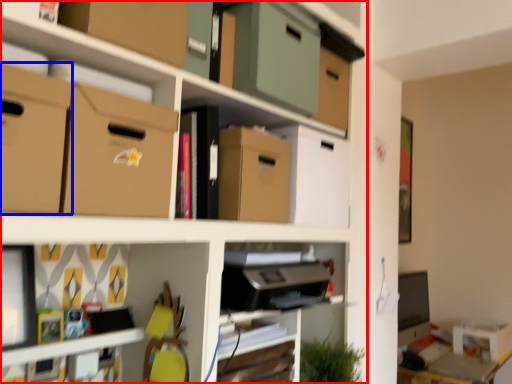
Question: Which object is further to the camera taking this photo, shelf (highlighted by a red box) or cardboard box (highlighted by a blue box)?

Choices:
 (A) shelf
 (B) cardboard box

Answer: (B)